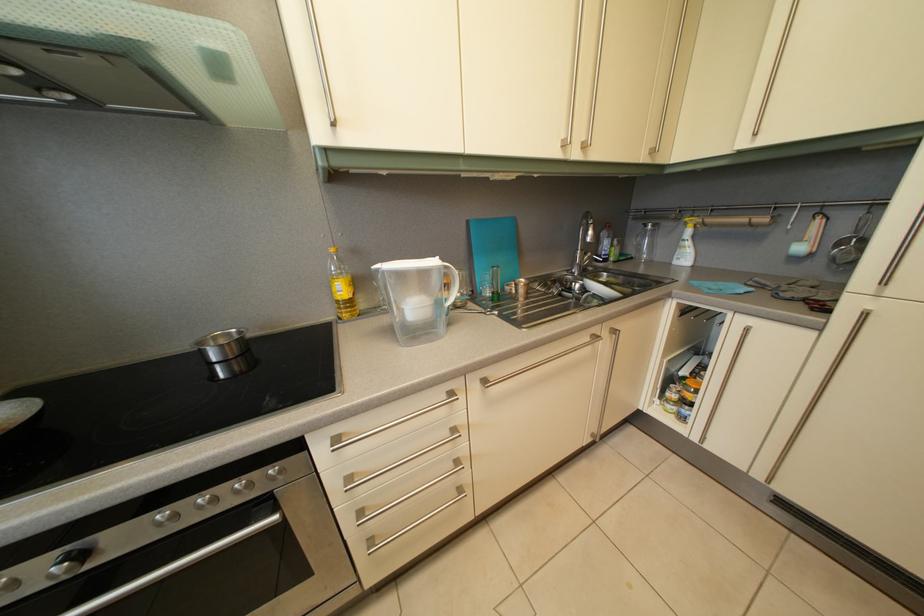
Identify the location of sink faucet handle. (581, 261).